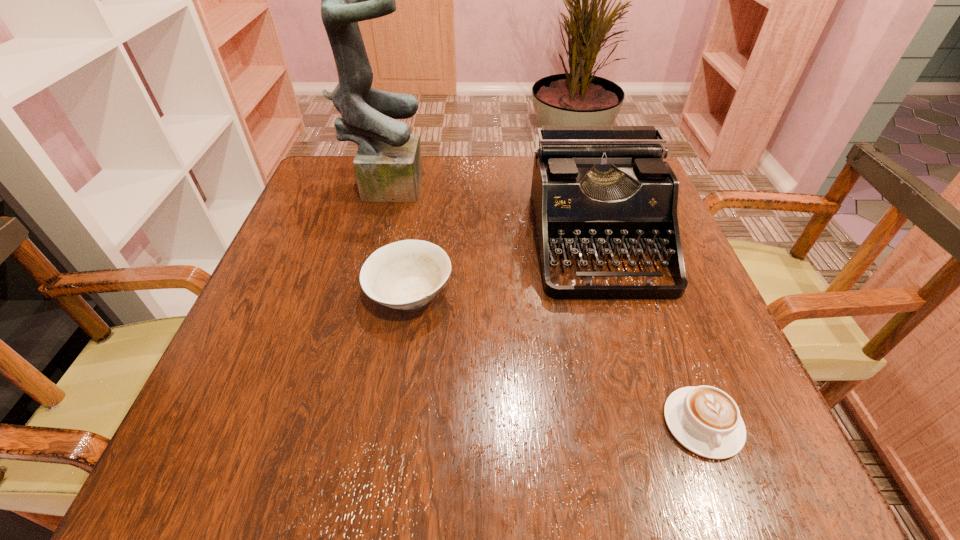
You are a GUI agent. You are given a task and a screenshot of the screen. Output one action in this format:
    pyautogui.click(x=<x>, y=<y>)
    Task: Click on the object that is at the near edge
    
    Given the screenshot: What is the action you would take?
    pyautogui.click(x=705, y=420)

Where is `object positioned at the left edge`? The image size is (960, 540). object positioned at the left edge is located at coordinates (388, 167).

Identify the location of typewriter that is at the right edge. The width and height of the screenshot is (960, 540). (594, 188).

Locate an element on the screen. This screenshot has width=960, height=540. cappuccino located in the right edge section of the desktop is located at coordinates (705, 420).

In order to click on object at the far left corner in this screenshot , I will do `click(388, 167)`.

Image resolution: width=960 pixels, height=540 pixels. I want to click on object located at the far right corner, so click(x=594, y=188).

Where is `object located at the near right corner`? object located at the near right corner is located at coordinates (705, 420).

The image size is (960, 540). Find the location of `vacant space at the far edge`. vacant space at the far edge is located at coordinates (498, 158).

Find the location of a particular element. The image size is (960, 540). vacant space at the near edge of the desktop is located at coordinates (410, 466).

Where is `free location at the left edge of the desktop`? Image resolution: width=960 pixels, height=540 pixels. free location at the left edge of the desktop is located at coordinates (259, 313).